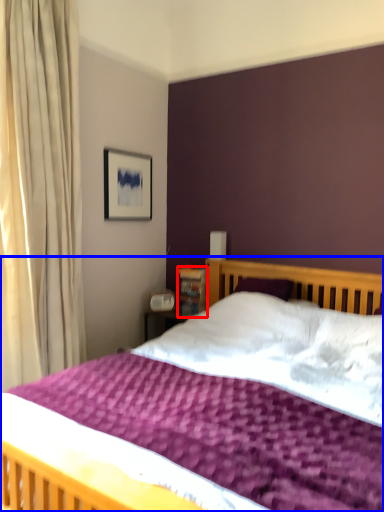
Question: Which of the following is the farthest to the observer, bookshelf (highlighted by a red box) or bed (highlighted by a blue box)?

Choices:
 (A) bookshelf
 (B) bed

Answer: (A)